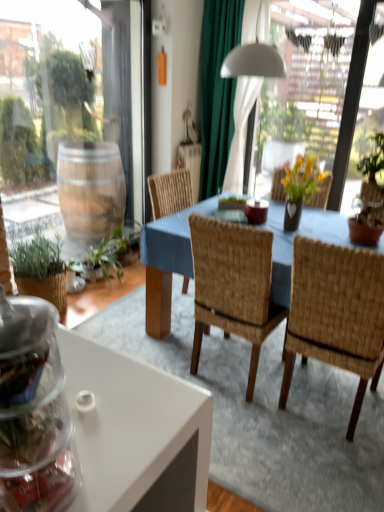
Question: Is woven wood chair at center, which is the second chair from left to right, positioned in front of green fabric curtain at upper center?

Choices:
 (A) no
 (B) yes

Answer: (B)

Question: Can you confirm if woven wood chair at center, the 1th chair positioned from the right, is bigger than green fabric curtain at upper center?

Choices:
 (A) yes
 (B) no

Answer: (A)

Question: Can you confirm if woven wood chair at center, which is the second chair from left to right, is taller than green fabric curtain at upper center?

Choices:
 (A) yes
 (B) no

Answer: (B)

Question: Is the surface of woven wood chair at center, which is the second chair from left to right, in direct contact with green fabric curtain at upper center?

Choices:
 (A) yes
 (B) no

Answer: (B)

Question: Is woven wood chair at center, which is the second chair from left to right, positioned far away from green fabric curtain at upper center?

Choices:
 (A) yes
 (B) no

Answer: (A)

Question: Would you say green fabric curtain at upper center is inside or outside woven wood chair at center, which is the 1th chair from left to right?

Choices:
 (A) inside
 (B) outside

Answer: (B)

Question: Is green fabric curtain at upper center wider or thinner than woven wood chair at center, which is counted as the 2th chair, starting from the right?

Choices:
 (A) wide
 (B) thin

Answer: (B)

Question: Is green fabric curtain at upper center taller or shorter than woven wood chair at center, which is counted as the 2th chair, starting from the right?

Choices:
 (A) tall
 (B) short

Answer: (A)

Question: From the image's perspective, is green fabric curtain at upper center positioned above or below woven wood chair at center, which is counted as the 2th chair, starting from the right?

Choices:
 (A) below
 (B) above

Answer: (B)

Question: Considering the positions of woven wood chair at center, which is the second chair from left to right, and green fabric curtain at upper center in the image, is woven wood chair at center, which is the second chair from left to right, taller or shorter than green fabric curtain at upper center?

Choices:
 (A) tall
 (B) short

Answer: (B)

Question: Is woven wood chair at center, which is the second chair from left to right, bigger or smaller than green fabric curtain at upper center?

Choices:
 (A) small
 (B) big

Answer: (B)

Question: Does point (347, 320) appear closer or farther from the camera than point (223, 151)?

Choices:
 (A) closer
 (B) farther

Answer: (A)

Question: Relative to green fabric curtain at upper center, is woven wood chair at center, which is the second chair from left to right, in front or behind?

Choices:
 (A) behind
 (B) front

Answer: (B)

Question: In terms of width, does woven wood chair at center, which is the second chair from left to right, look wider or thinner when compared to woven wood chair at center, which is counted as the 2th chair, starting from the right?

Choices:
 (A) thin
 (B) wide

Answer: (B)

Question: Is woven wood chair at center, which is the second chair from left to right, to the left or to the right of woven wood chair at center, which is the 1th chair from left to right, in the image?

Choices:
 (A) right
 (B) left

Answer: (A)